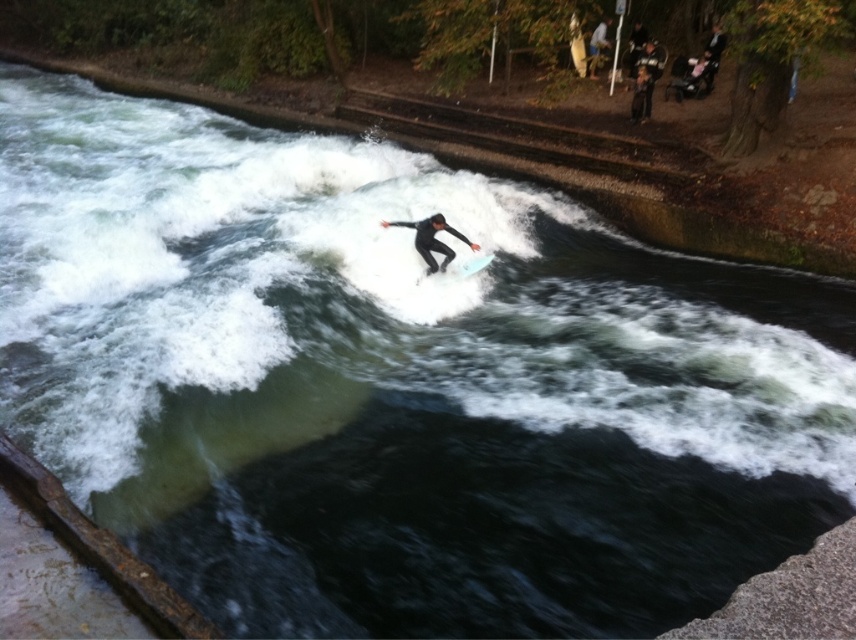
You are a photographer positioned at the origin point of the image coordinate system. You want to capture the white foam surfboard at center in your shot. What are the coordinates where you should aim your camera?

The white foam surfboard at center is located at coordinates point (474, 264), so you should aim your camera at those coordinates to capture it.

You are a photographer on the embankment trying to capture the surfer. If you focus your camera on the black wetsuit surfer at center, will the light blue smooth surfboard at center also be in focus in the same photo?

The black wetsuit surfer at center is in front of the light blue smooth surfboard at center, so focusing on the surfer would likely keep the surfboard in focus as well since they are both at the same central plane in the scene.

You are a safety officer at the water park and need to ensure the black wetsuit surfer at center is within the designated safety zone. According to the coordinates provided, is the surfer positioned correctly?

The black wetsuit surfer at center is located at point (432, 240), which is within the designated safety zone coordinates provided.